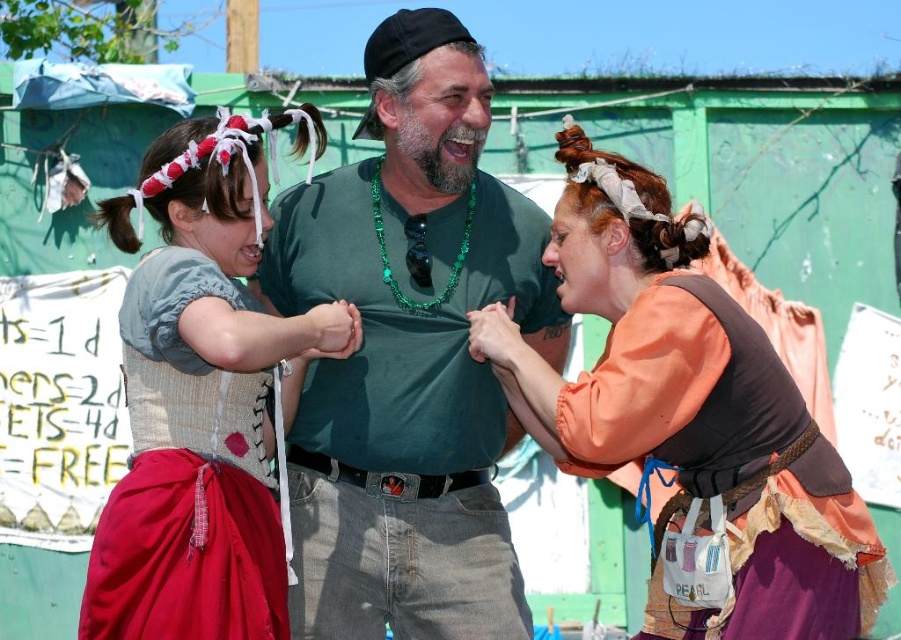
Which of these two, orange fabric dress at center or matte gray vest at center, stands taller?

With more height is orange fabric dress at center.

Is orange fabric dress at center to the right of matte gray vest at center from the viewer's perspective?

Yes, orange fabric dress at center is to the right of matte gray vest at center.

Does point (698, 374) come closer to viewer compared to point (171, 486)?

No, it is behind (171, 486).

In order to click on orange fabric dress at center in this screenshot , I will do `click(690, 420)`.

Is matte gray vest at center wider than emerald green beaded necklace at center?

Indeed, matte gray vest at center has a greater width compared to emerald green beaded necklace at center.

Does matte gray vest at center appear on the left side of emerald green beaded necklace at center?

Indeed, matte gray vest at center is positioned on the left side of emerald green beaded necklace at center.

Identify the location of matte gray vest at center. The image size is (901, 640). (203, 396).

Does point (793, 451) lie behind point (463, 234)?

No, it is not.

Who is more forward, (x=760, y=579) or (x=396, y=292)?

Positioned in front is point (x=760, y=579).

Does point (699, 284) lie in front of point (415, 243)?

Yes.

At what (x,y) coordinates should I click in order to perform the action: click on orange fabric dress at center. Please return your answer as a coordinate pair (x, y). Looking at the image, I should click on (690, 420).